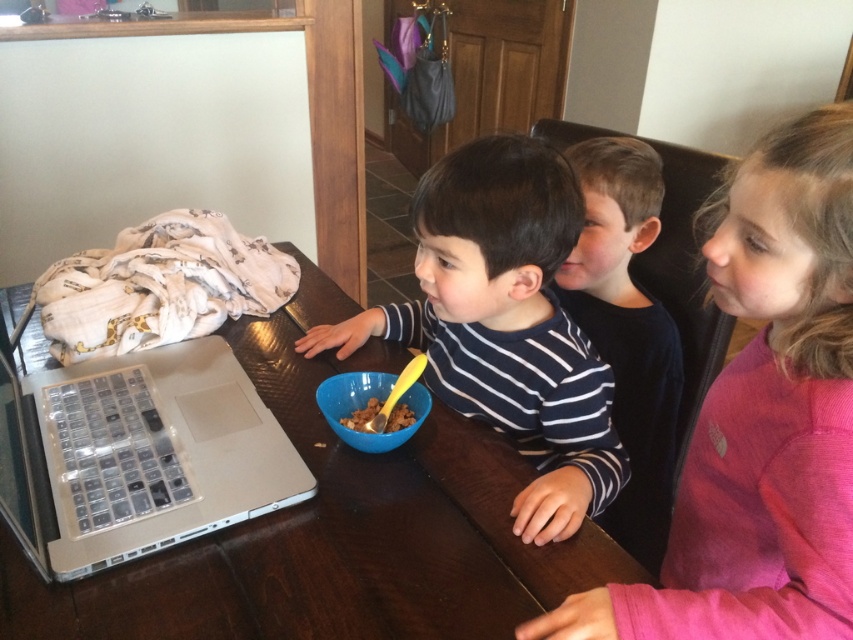
Question: Which point is closer to the camera taking this photo?

Choices:
 (A) (109, 540)
 (B) (579, 280)

Answer: (A)

Question: Which point is farther to the camera?

Choices:
 (A) blue plastic bowl at center
 (B) pink cotton shirt at upper right
 (C) brown crumbly cereal at center

Answer: (C)

Question: In this image, where is dark blue striped shirt at center located relative to blue plastic bowl at center?

Choices:
 (A) above
 (B) below

Answer: (A)

Question: Can you confirm if pink cotton shirt at upper right is thinner than striped cotton shirt at center?

Choices:
 (A) no
 (B) yes

Answer: (B)

Question: Is clear plastic keyboard at left wider than blue plastic bowl at center?

Choices:
 (A) yes
 (B) no

Answer: (A)

Question: Estimate the real-world distances between objects in this image. Which object is closer to the brown wooden table at center?

Choices:
 (A) brown crumbly cereal at center
 (B) dark blue striped shirt at center
 (C) pink cotton shirt at upper right

Answer: (A)